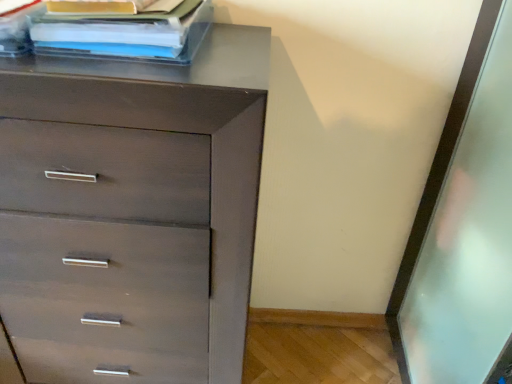
Describe the element at coordinates (131, 212) in the screenshot. I see `matte brown chest of drawers at upper left` at that location.

Locate an element on the screen. matte brown chest of drawers at upper left is located at coordinates (131, 212).

In order to face matte brown chest of drawers at upper left, should I rotate leftwards or rightwards?

You should look left and rotate roughly 17.516 degrees.

At what (x,y) coordinates should I click in order to perform the action: click on matte plastic book at upper left. Please return your answer as a coordinate pair (x, y). Image resolution: width=512 pixels, height=384 pixels. Looking at the image, I should click on (123, 34).

What do you see at coordinates (123, 34) in the screenshot?
I see `matte plastic book at upper left` at bounding box center [123, 34].

Find the location of a particular element. matte brown chest of drawers at upper left is located at coordinates 131,212.

Considering the positions of objects matte plastic book at upper left and matte brown chest of drawers at upper left in the image provided, who is more to the right, matte plastic book at upper left or matte brown chest of drawers at upper left?

Positioned to the right is matte plastic book at upper left.

In the image, is matte plastic book at upper left positioned in front of or behind matte brown chest of drawers at upper left?

Clearly, matte plastic book at upper left is behind matte brown chest of drawers at upper left.

Is point (184, 29) closer to camera compared to point (93, 300)?

Yes, it is.

From the image's perspective, is matte plastic book at upper left below matte brown chest of drawers at upper left?

No, from the image's perspective, matte plastic book at upper left is not beneath matte brown chest of drawers at upper left.

From a real-world perspective, is matte plastic book at upper left physically below matte brown chest of drawers at upper left?

Incorrect, from a real-world perspective, matte plastic book at upper left is higher than matte brown chest of drawers at upper left.

Which object is wider, matte plastic book at upper left or matte brown chest of drawers at upper left?

matte brown chest of drawers at upper left.

Between matte plastic book at upper left and matte brown chest of drawers at upper left, which one has less height?

matte plastic book at upper left is shorter.

In the scene shown: Considering the relative sizes of matte plastic book at upper left and matte brown chest of drawers at upper left in the image provided, is matte plastic book at upper left bigger than matte brown chest of drawers at upper left?

No.

Is matte plastic book at upper left inside or outside of matte brown chest of drawers at upper left?

matte plastic book at upper left is not inside matte brown chest of drawers at upper left, it's outside.

Are matte plastic book at upper left and matte brown chest of drawers at upper left far apart?

No, matte plastic book at upper left is not far from matte brown chest of drawers at upper left.

Could you tell me if matte plastic book at upper left is turned towards matte brown chest of drawers at upper left?

No, matte plastic book at upper left does not turn towards matte brown chest of drawers at upper left.

Can you tell me how much matte plastic book at upper left and matte brown chest of drawers at upper left differ in facing direction?

The facing directions of matte plastic book at upper left and matte brown chest of drawers at upper left are 6.98e-05 degrees apart.

How far apart are matte plastic book at upper left and matte brown chest of drawers at upper left?

A distance of 12.18 inches exists between matte plastic book at upper left and matte brown chest of drawers at upper left.

Identify the location of chest of drawers on the left of matte plastic book at upper left. This screenshot has height=384, width=512. (131, 212).

Is matte brown chest of drawers at upper left at the right side of matte plastic book at upper left?

No, matte brown chest of drawers at upper left is not to the right of matte plastic book at upper left.

Which object is closer to the camera taking this photo, matte brown chest of drawers at upper left or matte plastic book at upper left?

matte brown chest of drawers at upper left.

Which is behind, point (239, 372) or point (120, 35)?

Point (239, 372)

From the image's perspective, does matte brown chest of drawers at upper left appear lower than matte plastic book at upper left?

Correct, matte brown chest of drawers at upper left appears lower than matte plastic book at upper left in the image.

From a real-world perspective, which is physically below, matte brown chest of drawers at upper left or matte plastic book at upper left?

In real-world perspective, matte brown chest of drawers at upper left is lower.

Looking at this image, considering the relative sizes of matte brown chest of drawers at upper left and matte plastic book at upper left in the image provided, is matte brown chest of drawers at upper left wider than matte plastic book at upper left?

Indeed, matte brown chest of drawers at upper left has a greater width compared to matte plastic book at upper left.

Considering the sizes of objects matte brown chest of drawers at upper left and matte plastic book at upper left in the image provided, who is shorter, matte brown chest of drawers at upper left or matte plastic book at upper left?

With less height is matte plastic book at upper left.

Does matte brown chest of drawers at upper left have a larger size compared to matte plastic book at upper left?

Indeed, matte brown chest of drawers at upper left has a larger size compared to matte plastic book at upper left.

Would you say matte brown chest of drawers at upper left is inside or outside matte plastic book at upper left?

matte brown chest of drawers at upper left is outside matte plastic book at upper left.

Would you consider matte brown chest of drawers at upper left to be distant from matte plastic book at upper left?

matte brown chest of drawers at upper left is actually quite close to matte plastic book at upper left.

Is matte brown chest of drawers at upper left facing towards matte plastic book at upper left?

No, matte brown chest of drawers at upper left is not turned towards matte plastic book at upper left.

What's the angular difference between matte brown chest of drawers at upper left and matte plastic book at upper left's facing directions?

They differ by 6.98e-05 degrees in their facing directions.

Where is `book above the matte brown chest of drawers at upper left (from a real-world perspective)`? book above the matte brown chest of drawers at upper left (from a real-world perspective) is located at coordinates (123, 34).

Locate an element on the screen. The width and height of the screenshot is (512, 384). book above the matte brown chest of drawers at upper left (from a real-world perspective) is located at coordinates (x=123, y=34).

Where is `the chest of drawers lying in front of the matte plastic book at upper left`? The image size is (512, 384). the chest of drawers lying in front of the matte plastic book at upper left is located at coordinates (131, 212).